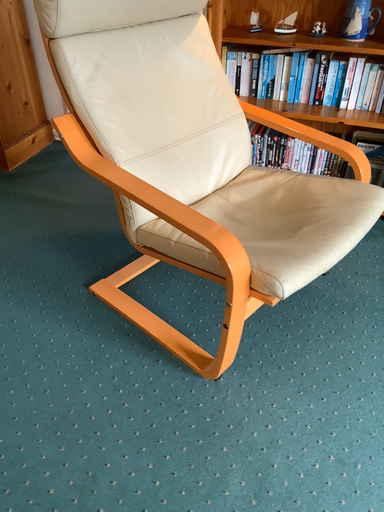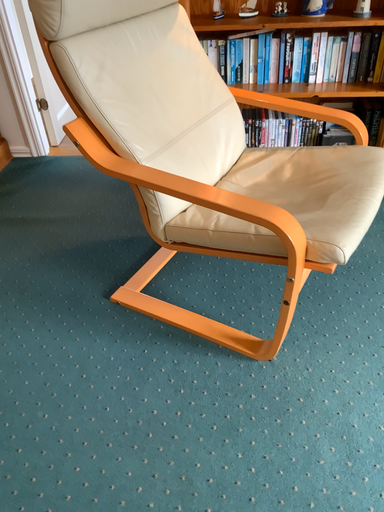
Question: How did the camera likely rotate when shooting the video?

Choices:
 (A) rotated left
 (B) rotated right

Answer: (B)